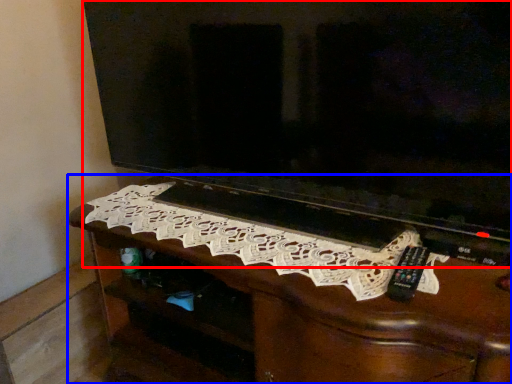
Question: Which object is further to the camera taking this photo, television (highlighted by a red box) or furniture (highlighted by a blue box)?

Choices:
 (A) television
 (B) furniture

Answer: (B)